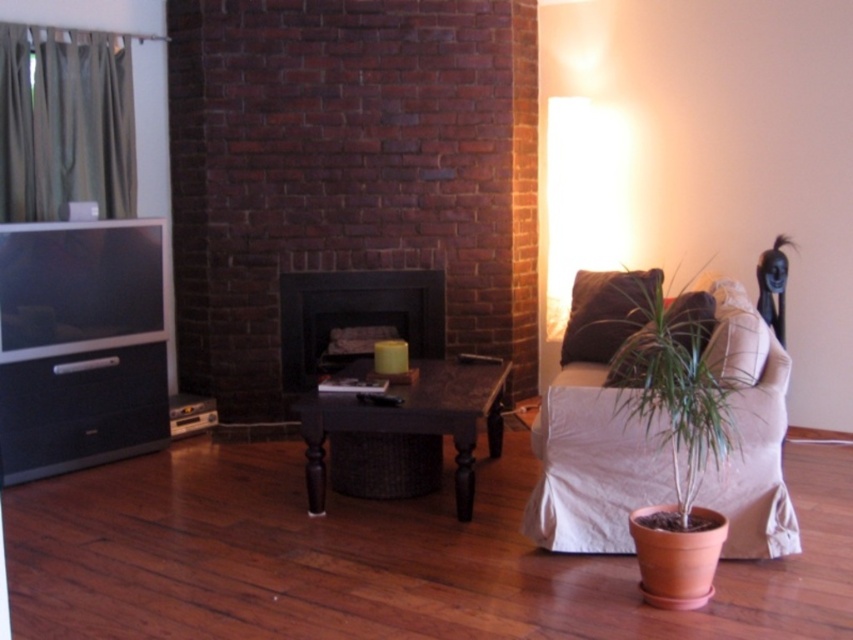
Question: Which is farther from the matte black fireplace at center?

Choices:
 (A) green matte plant at lower right
 (B) brown wicker table at center

Answer: (A)

Question: Considering the relative positions of green matte plant at lower right and matte black fireplace at center in the image provided, where is green matte plant at lower right located with respect to matte black fireplace at center?

Choices:
 (A) above
 (B) below

Answer: (B)

Question: Where is green matte plant at lower right located in relation to matte black fireplace at center in the image?

Choices:
 (A) left
 (B) right

Answer: (B)

Question: Among these objects, which one is farthest from the camera?

Choices:
 (A) matte black fireplace at center
 (B) brown wicker table at center
 (C) green matte plant at lower right

Answer: (A)

Question: Estimate the real-world distances between objects in this image. Which object is closer to the brown wicker table at center?

Choices:
 (A) green matte plant at lower right
 (B) matte black fireplace at center

Answer: (A)

Question: Considering the relative positions of green matte plant at lower right and brown wicker table at center in the image provided, where is green matte plant at lower right located with respect to brown wicker table at center?

Choices:
 (A) left
 (B) right

Answer: (B)